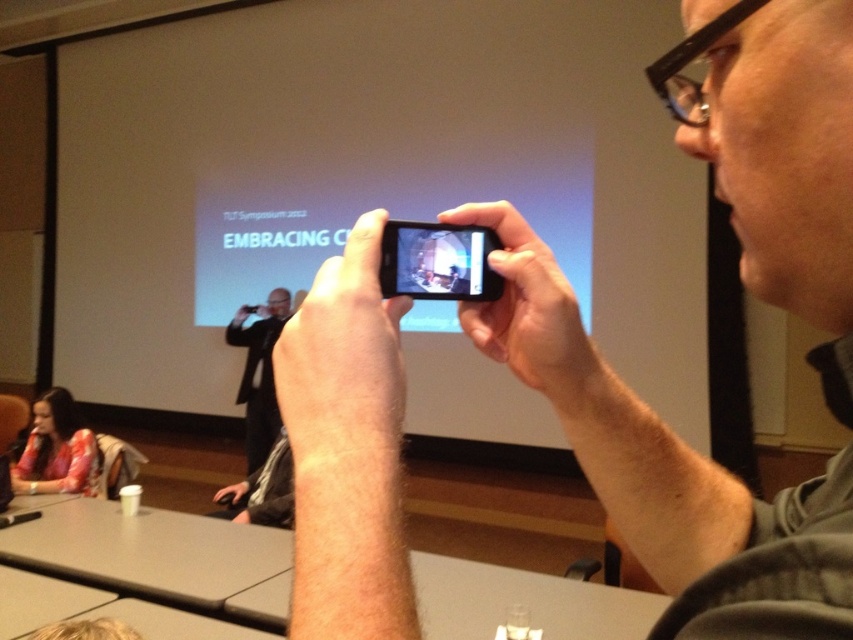
Question: Among these points, which one is farthest from the camera?

Choices:
 (A) (253, 406)
 (B) (816, 531)
 (C) (489, 292)
 (D) (62, 410)

Answer: (A)

Question: Can you confirm if black matte phone at center is smaller than floral fabric shirt at lower left?

Choices:
 (A) yes
 (B) no

Answer: (A)

Question: Does black matte phone at center have a lesser width compared to floral fabric shirt at lower left?

Choices:
 (A) no
 (B) yes

Answer: (B)

Question: Does black matte phone at center have a greater width compared to floral fabric shirt at lower left?

Choices:
 (A) yes
 (B) no

Answer: (B)

Question: Estimate the real-world distances between objects in this image. Which object is closer to the black matte phone at center?

Choices:
 (A) matte black phone at center
 (B) dark gray suit at center
 (C) floral fabric shirt at lower left

Answer: (A)

Question: Which point is closer to the camera?

Choices:
 (A) (781, 609)
 (B) (413, 260)
 (C) (230, 324)
 (D) (61, 492)

Answer: (A)